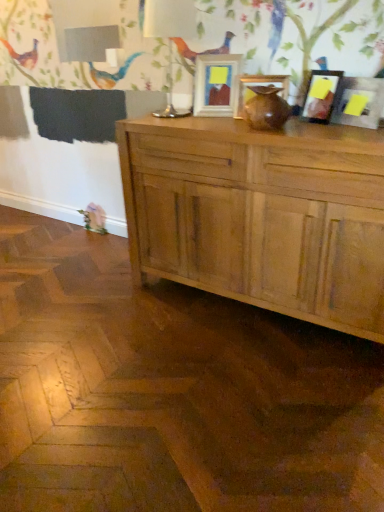
How much space does matte black picture frame at upper right, placed as the 2th picture frame when sorted from right to left, occupy vertically?

8.98 inches.

Measure the distance between point (281,76) and camera.

1.91 meters.

Where is `matte wooden picture frame at center, arranged as the 1th picture frame when viewed from the left`? matte wooden picture frame at center, arranged as the 1th picture frame when viewed from the left is located at coordinates (215, 84).

Identify the location of white glossy table lamp at upper center. The image size is (384, 512). (170, 36).

At what (x,y) coordinates should I click in order to perform the action: click on matte black picture frame at upper right, placed as the 2th picture frame when sorted from right to left. Please return your answer as a coordinate pair (x, y). Image resolution: width=384 pixels, height=512 pixels. Looking at the image, I should click on (321, 96).

Identify the location of picture frame that is the 2nd object located below the matte wooden picture frame at center, which appears as the 3th picture frame when viewed from the right (from the image's perspective). (359, 102).

Considering the sizes of matte black picture frame at upper right, the fourth picture frame positioned from the left, and matte wooden picture frame at center, which appears as the 3th picture frame when viewed from the right, in the image, is matte black picture frame at upper right, the fourth picture frame positioned from the left, bigger or smaller than matte wooden picture frame at center, which appears as the 3th picture frame when viewed from the right,?

In the image, matte black picture frame at upper right, the fourth picture frame positioned from the left, appears to be smaller than matte wooden picture frame at center, which appears as the 3th picture frame when viewed from the right.

How different are the orientations of matte black picture frame at upper right, the fourth picture frame positioned from the left, and matte wooden picture frame at center, acting as the 2th picture frame starting from the left, in degrees?

31.7 degrees separate the facing orientations of matte black picture frame at upper right, the fourth picture frame positioned from the left, and matte wooden picture frame at center, acting as the 2th picture frame starting from the left.

At what (x,y) coordinates should I click in order to perform the action: click on the 2nd picture frame positioned above the natural wood cabinet at center (from a real-world perspective). Please return your answer as a coordinate pair (x, y). This screenshot has height=512, width=384. Looking at the image, I should click on (258, 86).

Is matte wooden picture frame at center, acting as the 2th picture frame starting from the left, outside of natural wood cabinet at center?

Indeed, matte wooden picture frame at center, acting as the 2th picture frame starting from the left, is completely outside natural wood cabinet at center.

Is matte wooden picture frame at center, which appears as the 3th picture frame when viewed from the right, aimed at natural wood cabinet at center?

No, matte wooden picture frame at center, which appears as the 3th picture frame when viewed from the right, is not oriented towards natural wood cabinet at center.

How much distance is there between matte wooden picture frame at center, acting as the 2th picture frame starting from the left, and natural wood cabinet at center?

50.73 centimeters.

Is matte wooden picture frame at center, which appears as the 3th picture frame when viewed from the right, in contact with matte black picture frame at upper right, the fourth picture frame positioned from the left?

No, matte wooden picture frame at center, which appears as the 3th picture frame when viewed from the right, is not in contact with matte black picture frame at upper right, the fourth picture frame positioned from the left.

Is matte wooden picture frame at center, acting as the 2th picture frame starting from the left, completely or partially outside of matte black picture frame at upper right, which ranks as the first picture frame in right-to-left order?

matte wooden picture frame at center, acting as the 2th picture frame starting from the left, lies outside matte black picture frame at upper right, which ranks as the first picture frame in right-to-left order,'s area.

Identify the location of the 2nd picture frame in front of the matte wooden picture frame at center, acting as the 2th picture frame starting from the left, starting your count from the anchor. This screenshot has height=512, width=384. (359, 102).

Considering the relative positions of matte wooden picture frame at center, which appears as the 3th picture frame when viewed from the right, and matte black picture frame at upper right, which ranks as the first picture frame in right-to-left order, in the image provided, is matte wooden picture frame at center, which appears as the 3th picture frame when viewed from the right, to the right of matte black picture frame at upper right, which ranks as the first picture frame in right-to-left order, from the viewer's perspective?

No, matte wooden picture frame at center, which appears as the 3th picture frame when viewed from the right, is not to the right of matte black picture frame at upper right, which ranks as the first picture frame in right-to-left order.

Which of these two, matte wooden picture frame at center, acting as the 2th picture frame starting from the left, or matte black picture frame at upper right, placed as the 3th picture frame when sorted from left to right, is thinner?

With smaller width is matte wooden picture frame at center, acting as the 2th picture frame starting from the left.

Is matte wooden picture frame at center, acting as the 2th picture frame starting from the left, oriented away from matte black picture frame at upper right, placed as the 3th picture frame when sorted from left to right?

No, matte wooden picture frame at center, acting as the 2th picture frame starting from the left, is not facing away from matte black picture frame at upper right, placed as the 3th picture frame when sorted from left to right.

Could you measure the distance between matte wooden picture frame at center, which appears as the 3th picture frame when viewed from the right, and matte black picture frame at upper right, placed as the 2th picture frame when sorted from right to left?

matte wooden picture frame at center, which appears as the 3th picture frame when viewed from the right, and matte black picture frame at upper right, placed as the 2th picture frame when sorted from right to left, are 24.28 centimeters apart.

Considering the positions of objects matte wooden picture frame at center, which appears as the 3th picture frame when viewed from the right, and matte black picture frame at upper right, placed as the 2th picture frame when sorted from right to left, in the image provided, who is in front, matte wooden picture frame at center, which appears as the 3th picture frame when viewed from the right, or matte black picture frame at upper right, placed as the 2th picture frame when sorted from right to left,?

matte black picture frame at upper right, placed as the 2th picture frame when sorted from right to left, is in front.

Can you confirm if natural wood cabinet at center is positioned to the right of matte wooden picture frame at center, arranged as the 1th picture frame when viewed from the left?

Yes, natural wood cabinet at center is to the right of matte wooden picture frame at center, arranged as the 1th picture frame when viewed from the left.

Which picture frame is the 4th one when counting from the back of the natural wood cabinet at center? Please provide its 2D coordinates.

[(215, 84)]

Would you say white glossy table lamp at upper center is a long distance from matte black picture frame at upper right, placed as the 2th picture frame when sorted from right to left?

They are positioned close to each other.

Which is less distant, (159, 10) or (301, 114)?

Point (159, 10)

Can you confirm if white glossy table lamp at upper center is thinner than matte black picture frame at upper right, placed as the 3th picture frame when sorted from left to right?

In fact, white glossy table lamp at upper center might be wider than matte black picture frame at upper right, placed as the 3th picture frame when sorted from left to right.

In the scene shown: Which is more to the left, white glossy table lamp at upper center or matte black picture frame at upper right, placed as the 2th picture frame when sorted from right to left?

white glossy table lamp at upper center.

From the image's perspective, which one is positioned higher, matte black picture frame at upper right, placed as the 2th picture frame when sorted from right to left, or white glossy table lamp at upper center?

From the image's view, white glossy table lamp at upper center is above.

Which is nearer, (336, 87) or (190, 20)?

The point (336, 87) is in front.

Is matte black picture frame at upper right, placed as the 2th picture frame when sorted from right to left, looking in the opposite direction of white glossy table lamp at upper center?

No, matte black picture frame at upper right, placed as the 2th picture frame when sorted from right to left,'s orientation is not away from white glossy table lamp at upper center.

How different are the orientations of matte black picture frame at upper right, placed as the 3th picture frame when sorted from left to right, and white glossy table lamp at upper center in degrees?

matte black picture frame at upper right, placed as the 3th picture frame when sorted from left to right, and white glossy table lamp at upper center are facing 24.6 degrees away from each other.

Which picture frame is the 2nd one when counting from the back of the matte black picture frame at upper right, the fourth picture frame positioned from the left? Please provide its 2D coordinates.

[(258, 86)]

You are a GUI agent. You are given a task and a screenshot of the screen. Output one action in this format:
    pyautogui.click(x=<x>, y=<y>)
    Task: Click on the picture frame that is the 3rd one when counting upward from the natural wood cabinet at center (from the image's perspective)
    The image size is (384, 512).
    Given the screenshot: What is the action you would take?
    pyautogui.click(x=258, y=86)

Which object lies further to the anchor point matte black picture frame at upper right, placed as the 3th picture frame when sorted from left to right, white glossy table lamp at upper center or matte wooden picture frame at center, which is the 4th picture frame in right-to-left order?

white glossy table lamp at upper center is further to matte black picture frame at upper right, placed as the 3th picture frame when sorted from left to right.

Which object lies further to the anchor point natural wood cabinet at center, matte wooden picture frame at center, which appears as the 3th picture frame when viewed from the right, or matte black picture frame at upper right, the fourth picture frame positioned from the left?

Among the two, matte black picture frame at upper right, the fourth picture frame positioned from the left, is located further to natural wood cabinet at center.

Estimate the real-world distances between objects in this image. Which object is further from matte black picture frame at upper right, placed as the 2th picture frame when sorted from right to left, natural wood cabinet at center or matte wooden picture frame at center, which appears as the 3th picture frame when viewed from the right?

Among the two, natural wood cabinet at center is located further to matte black picture frame at upper right, placed as the 2th picture frame when sorted from right to left.

From the image, which object appears to be farther from matte black picture frame at upper right, the fourth picture frame positioned from the left, matte wooden picture frame at center, which appears as the 3th picture frame when viewed from the right, or matte black picture frame at upper right, placed as the 3th picture frame when sorted from left to right?

Among the two, matte wooden picture frame at center, which appears as the 3th picture frame when viewed from the right, is located further to matte black picture frame at upper right, the fourth picture frame positioned from the left.

Based on their spatial positions, is matte wooden picture frame at center, acting as the 2th picture frame starting from the left, or white glossy table lamp at upper center further from matte wooden picture frame at center, which is the 4th picture frame in right-to-left order?

white glossy table lamp at upper center is further to matte wooden picture frame at center, which is the 4th picture frame in right-to-left order.

Based on their spatial positions, is matte black picture frame at upper right, the fourth picture frame positioned from the left, or matte wooden picture frame at center, which appears as the 3th picture frame when viewed from the right, closer to natural wood cabinet at center?

matte wooden picture frame at center, which appears as the 3th picture frame when viewed from the right.

Looking at the image, which one is located further to white glossy table lamp at upper center, matte black picture frame at upper right, placed as the 3th picture frame when sorted from left to right, or matte wooden picture frame at center, acting as the 2th picture frame starting from the left?

matte black picture frame at upper right, placed as the 3th picture frame when sorted from left to right, is further to white glossy table lamp at upper center.

When comparing their distances from white glossy table lamp at upper center, does matte wooden picture frame at center, which appears as the 3th picture frame when viewed from the right, or matte black picture frame at upper right, the fourth picture frame positioned from the left, seem closer?

matte wooden picture frame at center, which appears as the 3th picture frame when viewed from the right.

This screenshot has height=512, width=384. I want to click on picture frame located between matte wooden picture frame at center, acting as the 2th picture frame starting from the left, and matte black picture frame at upper right, the fourth picture frame positioned from the left, in the left-right direction, so click(321, 96).

In order to click on picture frame between white glossy table lamp at upper center and matte wooden picture frame at center, acting as the 2th picture frame starting from the left, in the horizontal direction in this screenshot , I will do `click(215, 84)`.

I want to click on picture frame situated between matte wooden picture frame at center, which is the 4th picture frame in right-to-left order, and matte black picture frame at upper right, placed as the 3th picture frame when sorted from left to right, from left to right, so click(258, 86).

Locate an element on the screen. The height and width of the screenshot is (512, 384). picture frame between matte black picture frame at upper right, placed as the 3th picture frame when sorted from left to right, and natural wood cabinet at center in the up-down direction is located at coordinates (359, 102).